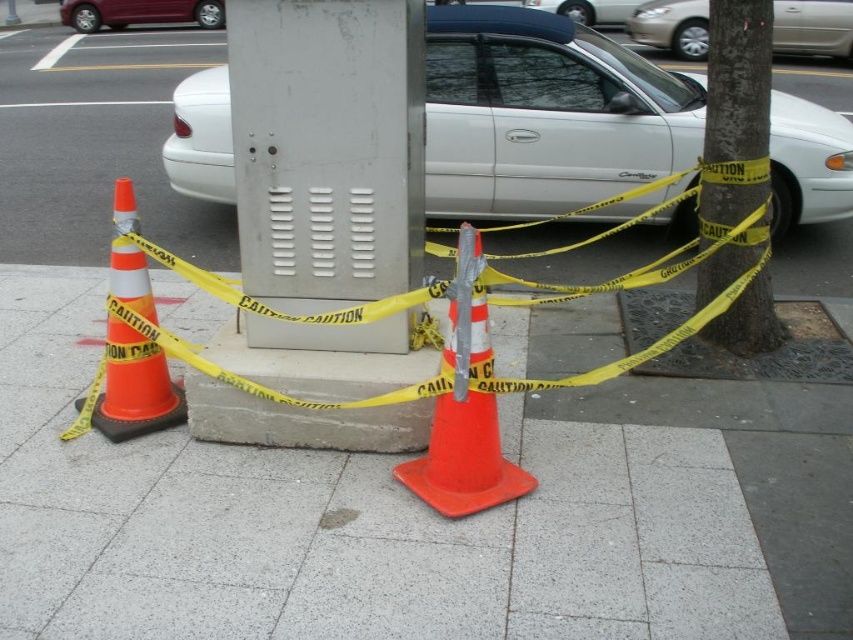
Who is more distant from viewer, (167, 392) or (639, 38)?

Point (639, 38)

Can you confirm if orange reflective cone at left is wider than silver metallic sedan at upper right?

In fact, orange reflective cone at left might be narrower than silver metallic sedan at upper right.

I want to click on orange reflective cone at left, so click(x=135, y=387).

Does yellow caution tape at center appear over orange reflective cone at left?

Indeed, yellow caution tape at center is positioned over orange reflective cone at left.

Describe the element at coordinates (735, 115) in the screenshot. I see `yellow caution tape at center` at that location.

This screenshot has height=640, width=853. In order to click on yellow caution tape at center in this screenshot , I will do pos(735,115).

Does white matte car at center lie behind orange reflective cone at left?

That is True.

Which is above, white matte car at center or orange reflective cone at left?

white matte car at center is above.

This screenshot has width=853, height=640. Find the location of `white matte car at center`. white matte car at center is located at coordinates (547, 115).